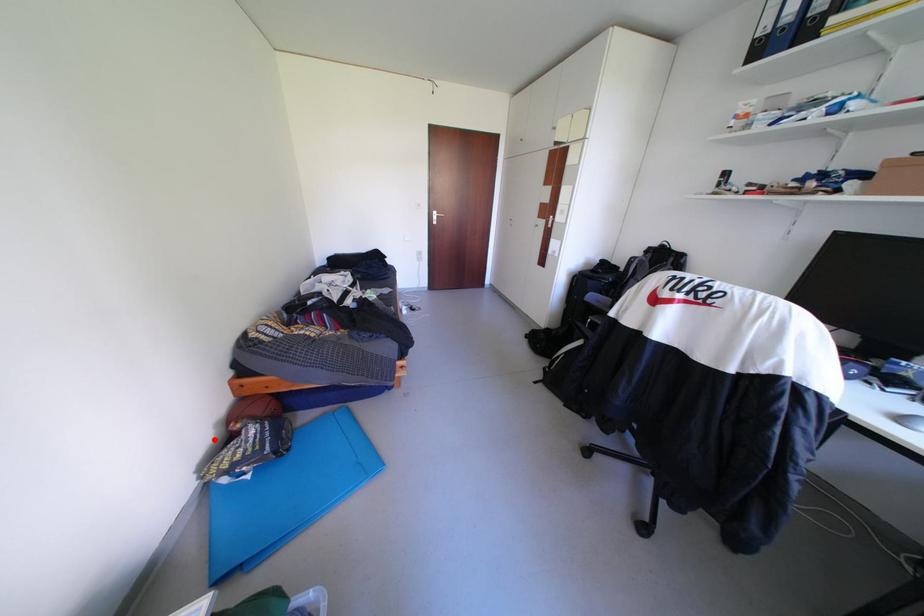
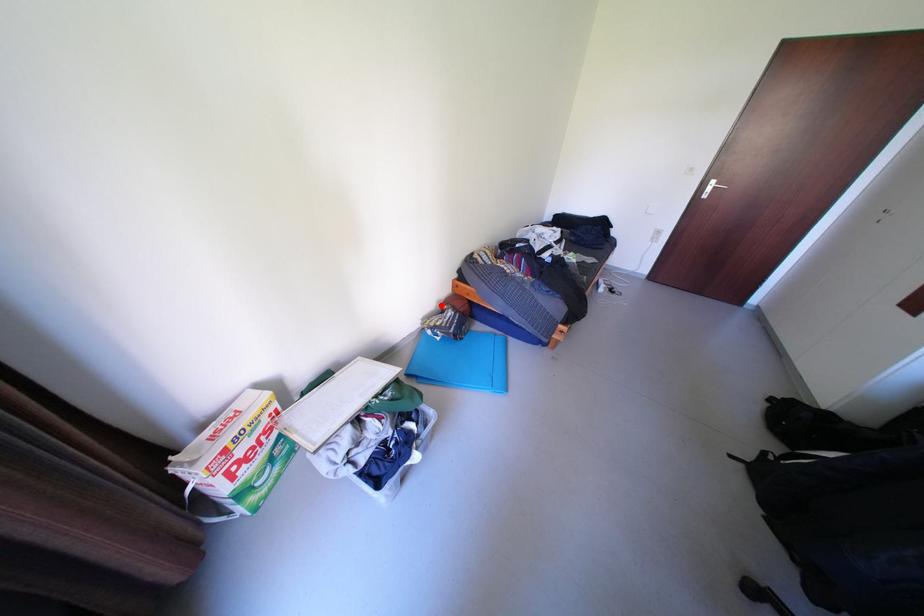
I am providing you with two images of the same scene from different viewpoints. A red point is marked on the first image and another point is marked on the second image. Does the point marked in image1 correspond to the same location as the one in image2?

Yes